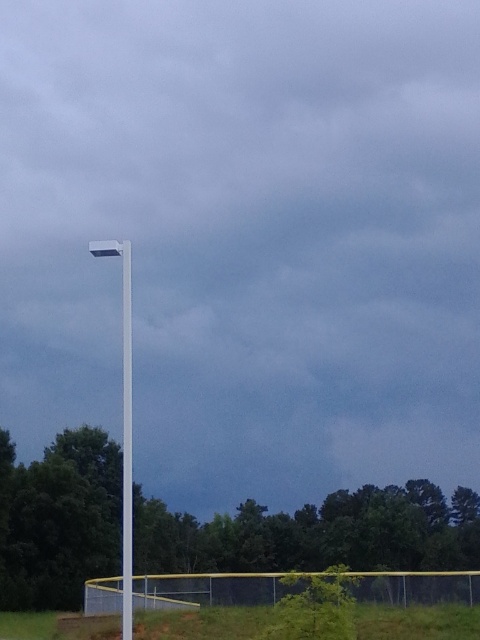
Question: Can you confirm if white smooth pole at upper left is positioned above white plastic pole at center?

Choices:
 (A) yes
 (B) no

Answer: (B)

Question: Considering the relative positions of white smooth pole at upper left and white plastic pole at center in the image provided, where is white smooth pole at upper left located with respect to white plastic pole at center?

Choices:
 (A) right
 (B) left

Answer: (B)

Question: Considering the relative positions of white smooth pole at upper left and white plastic pole at center in the image provided, where is white smooth pole at upper left located with respect to white plastic pole at center?

Choices:
 (A) above
 (B) below

Answer: (B)

Question: Which of the following is the closest to the observer?

Choices:
 (A) white plastic pole at center
 (B) white smooth pole at upper left

Answer: (B)

Question: Which of the following is the closest to the observer?

Choices:
 (A) (129, 593)
 (B) (124, 394)

Answer: (A)